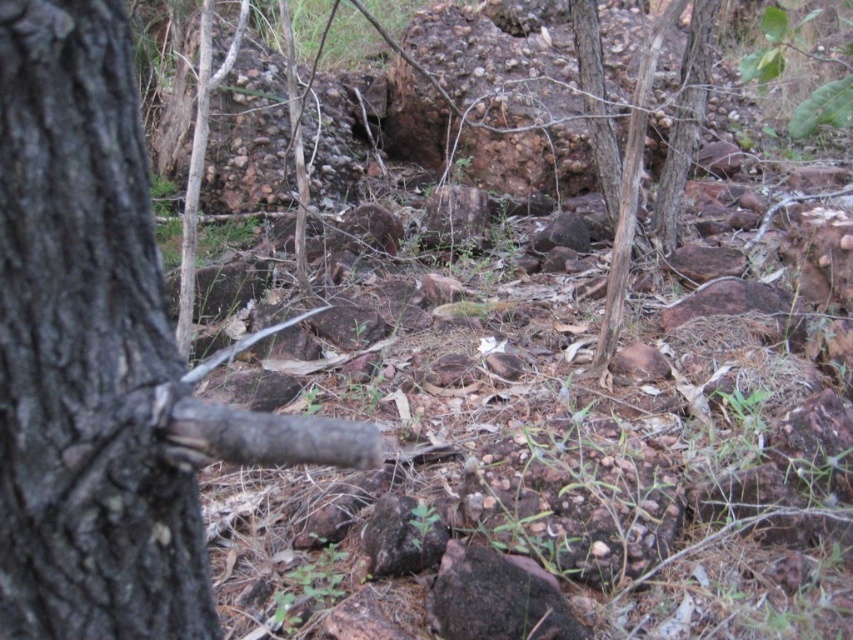
You are a hiker trying to cross a rocky path. You notice two trees in your view. The dark brown bark tree at left and the brown rough tree trunk at center. Which tree has a wider trunk?

The dark brown bark tree at left has a wider trunk than the brown rough tree trunk at center, as its width surpasses the latter.

You are a hiker trying to navigate through the forest. You see the dark brown bark tree at left and the dark brown rough rock at center. Which object is taller and can be used as a landmark?

The dark brown bark tree at left is much taller than the dark brown rough rock at center, so it can be used as a landmark.